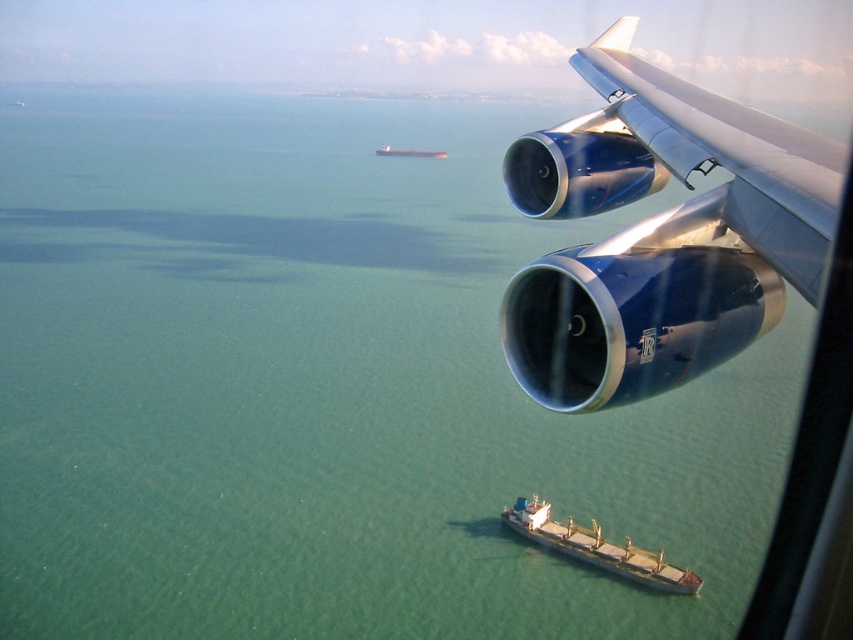
You are a passenger sitting by the window on this airplane. You notice the blue metallic engine at upper right and the metallic gray ship at center. Which object is closer to you from your seat?

The blue metallic engine at upper right is closer to you because it is located below the metallic gray ship at center, meaning it is in a lower position relative to your viewpoint.